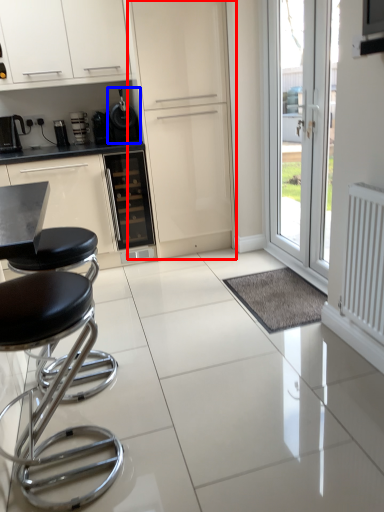
Question: Which object appears closest to the camera in this image, screen door (highlighted by a red box) or appliance (highlighted by a blue box)?

Choices:
 (A) screen door
 (B) appliance

Answer: (A)